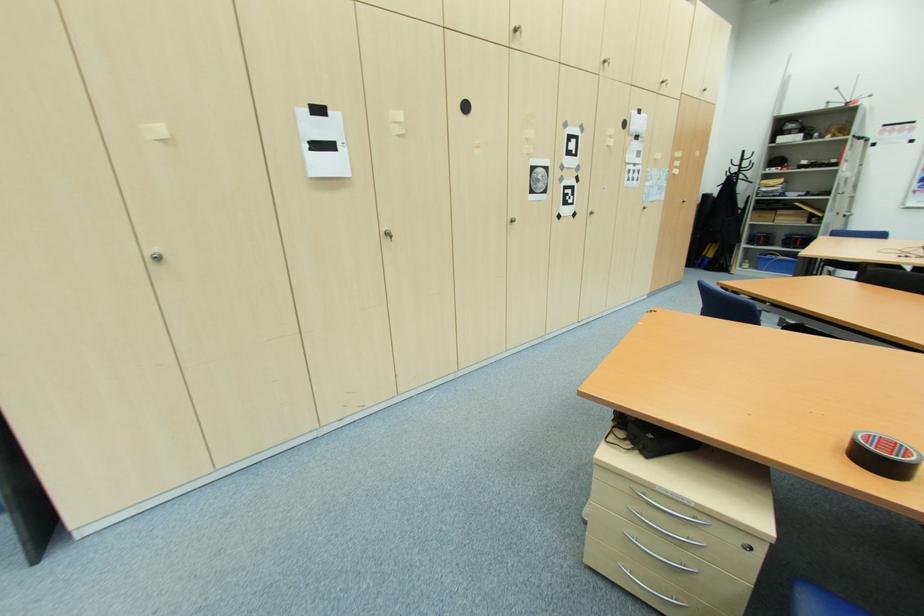
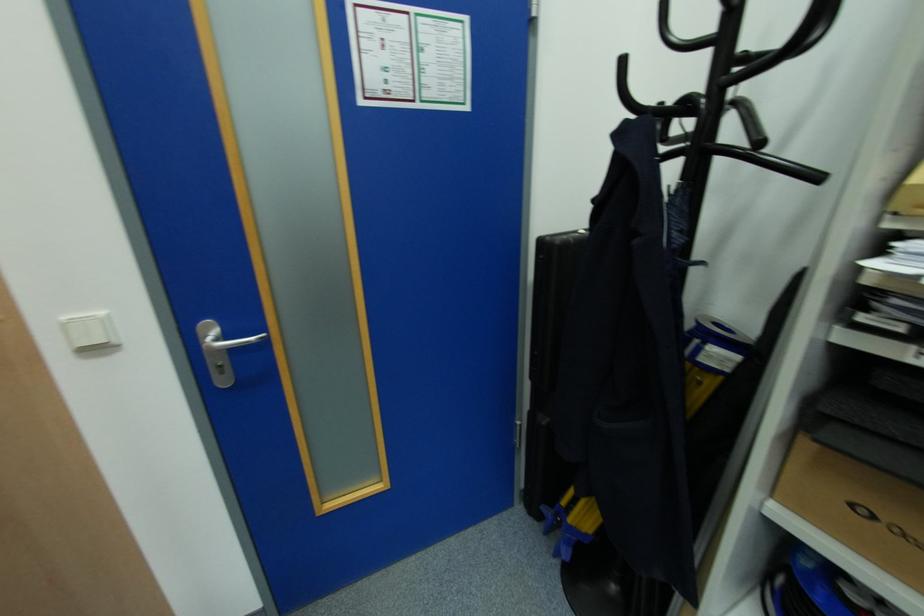
The point at (744, 169) is marked in the first image. Where is the corresponding point in the second image?

(726, 61)